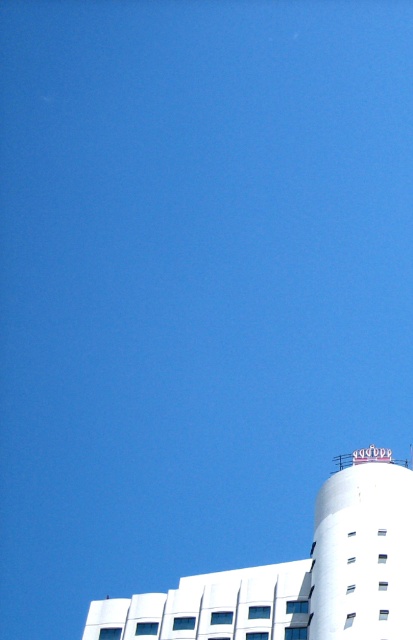
Question: Can you confirm if white smooth building at lower right is smaller than white smooth water tower at bottom right?

Choices:
 (A) no
 (B) yes

Answer: (A)

Question: Which point is closer to the camera?

Choices:
 (A) (349, 628)
 (B) (116, 616)

Answer: (A)

Question: Does white smooth building at lower right appear on the right side of white smooth water tower at bottom right?

Choices:
 (A) no
 (B) yes

Answer: (A)

Question: Considering the relative positions of white smooth building at lower right and white smooth water tower at bottom right in the image provided, where is white smooth building at lower right located with respect to white smooth water tower at bottom right?

Choices:
 (A) right
 (B) left

Answer: (B)